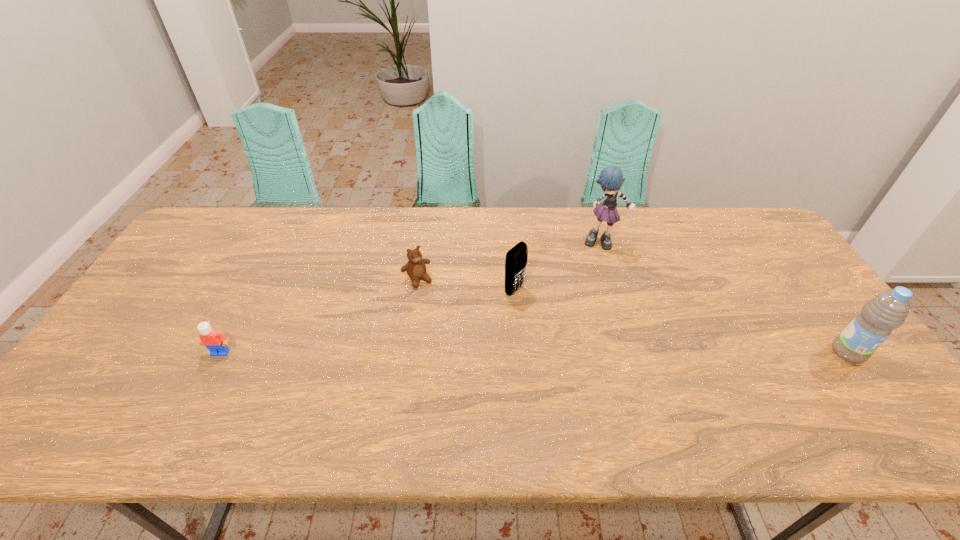
Locate an element on the screen. The image size is (960, 540). vacant space on the desktop that is between the Lego and the water bottle and is positioned at the face of the fourth object from right to left is located at coordinates (461, 353).

Locate an element on the screen. free spot on the desktop that is between the Lego and the fourth shortest object and is positioned on the screen of the third tallest object is located at coordinates (620, 353).

Identify the location of free space on the desktop that is between the leftmost object and the rightmost object and is positioned on the front-facing side of the tallest object. (614, 353).